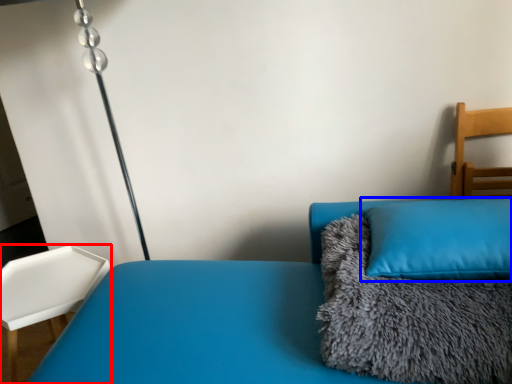
Question: Which point is further to the camera, furniture (highlighted by a red box) or pillow (highlighted by a blue box)?

Choices:
 (A) furniture
 (B) pillow

Answer: (A)